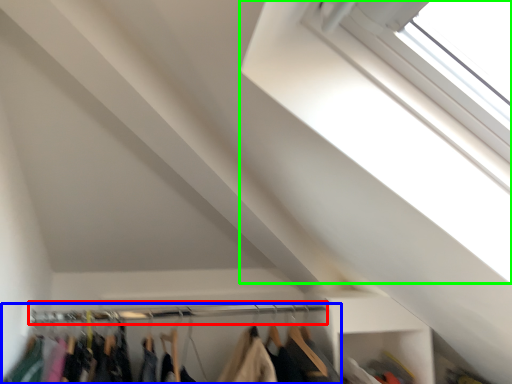
Question: Which is nearer to the clothesline (highlighted by a red box)? closet (highlighted by a blue box) or window (highlighted by a green box).

Choices:
 (A) closet
 (B) window

Answer: (A)